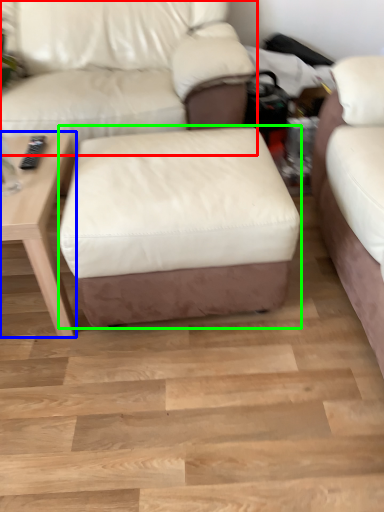
Question: Which object is the farthest from studio couch (highlighted by a red box)? Choose among these: table (highlighted by a blue box) or stool (highlighted by a green box).

Choices:
 (A) table
 (B) stool

Answer: (B)